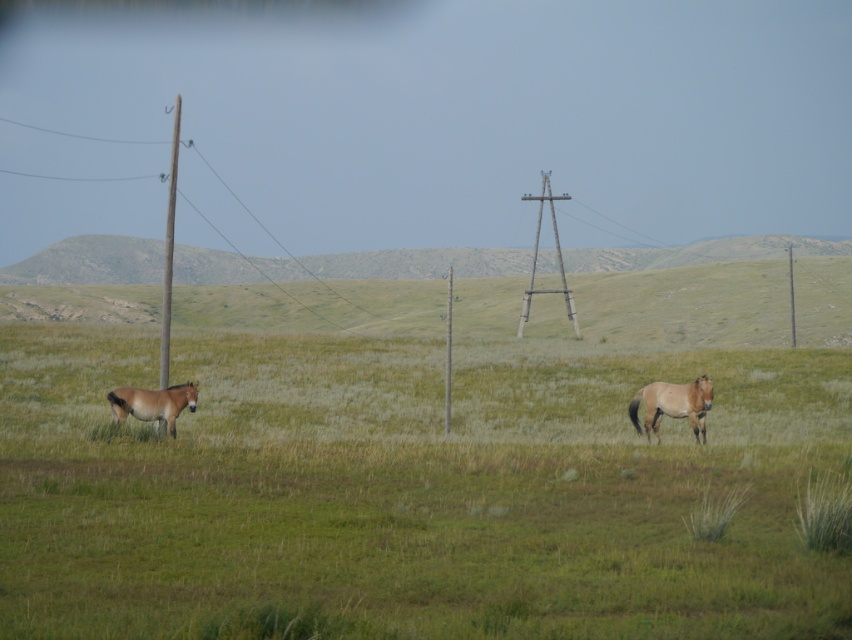
You are a bird flying over the rural landscape. You see the brown wooden telegraph pole at left and the smooth wood telegraph pole at center. Which pole is closer to the ground?

The smooth wood telegraph pole at center is closer to the ground because the brown wooden telegraph pole at left is positioned over it.

You are a maintenance worker needing to inspect the wires between the brown wooden telegraph pole at left and the smooth wood telegraph pole at center. If your ladder can extend up to 25 meters, will it be sufficient to reach the wires between these two poles?

The distance between the brown wooden telegraph pole at left and the smooth wood telegraph pole at center is 27.27 meters. Since the ladder can only extend up to 25 meters, it will not be sufficient to reach the wires between these two poles.

You are a photographer standing in the field. You want to take a photo of the brown glossy horse at left and the metallic gray telegraph pole at center. Which object is shorter in the scene?

The brown glossy horse at left is shorter than the metallic gray telegraph pole at center.